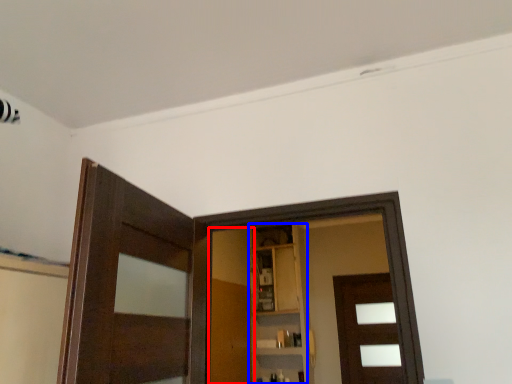
Question: Among these objects, which one is farthest to the camera, barn door (highlighted by a red box) or cabinetry (highlighted by a blue box)?

Choices:
 (A) barn door
 (B) cabinetry

Answer: (B)